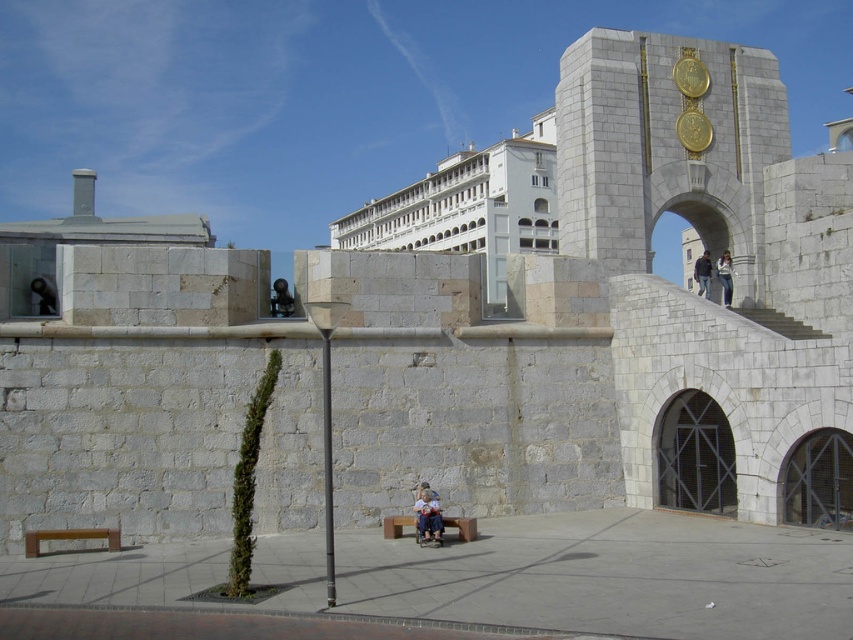
You are a GUI agent. You are given a task and a screenshot of the screen. Output one action in this format:
    pyautogui.click(x=<x>, y=<y>)
    Task: Click on the wooden bench at lower left
    The width and height of the screenshot is (853, 640).
    Given the screenshot: What is the action you would take?
    pyautogui.click(x=70, y=538)

How far apart are wooden bench at lower left and denim pants at center?

wooden bench at lower left and denim pants at center are 26.88 meters apart.

What do you see at coordinates (70, 538) in the screenshot? The height and width of the screenshot is (640, 853). I see `wooden bench at lower left` at bounding box center [70, 538].

Identify the location of wooden bench at lower left. Image resolution: width=853 pixels, height=640 pixels. (70, 538).

Locate an element on the screen. light blue denim jeans at center is located at coordinates (428, 516).

Is light blue denim jeans at center below red wooden bench at lower center?

No, light blue denim jeans at center is not below red wooden bench at lower center.

Is point (439, 508) positioned in front of point (389, 531)?

Yes, it is in front of point (389, 531).

What are the coordinates of `light blue denim jeans at center` in the screenshot? It's located at (428, 516).

Can you confirm if light blue denim jeans at center is smaller than denim pants at center?

Indeed, light blue denim jeans at center has a smaller size compared to denim pants at center.

Does point (437, 509) come closer to viewer compared to point (727, 266)?

Yes, point (437, 509) is in front of point (727, 266).

Locate an element on the screen. Image resolution: width=853 pixels, height=640 pixels. light blue denim jeans at center is located at coordinates [428, 516].